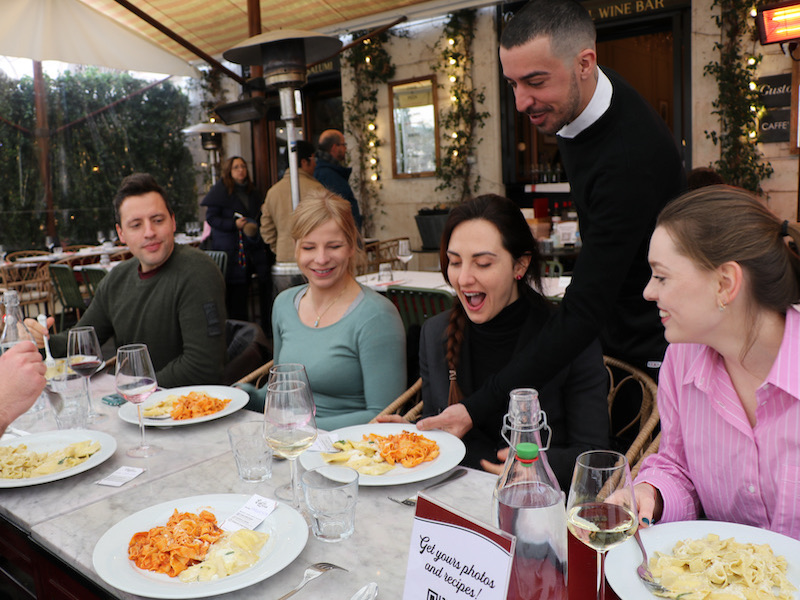
Identify the location of clear glass water bottles. (536, 484), (10, 322).